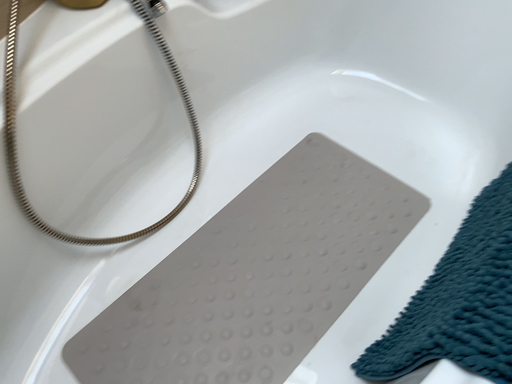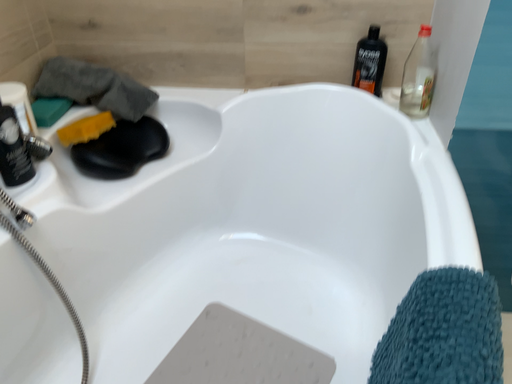
Question: Which way did the camera rotate in the video?

Choices:
 (A) rotated upward
 (B) rotated downward

Answer: (A)